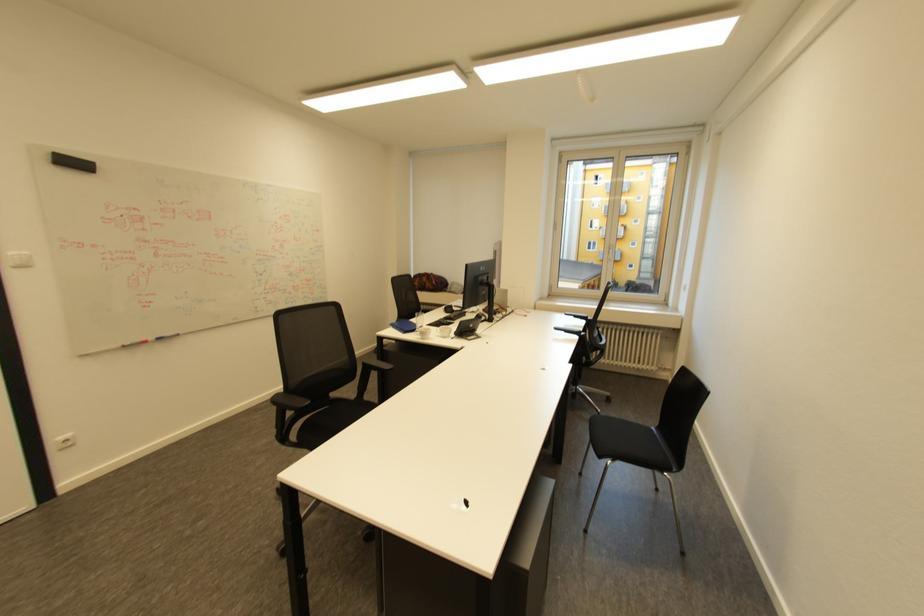
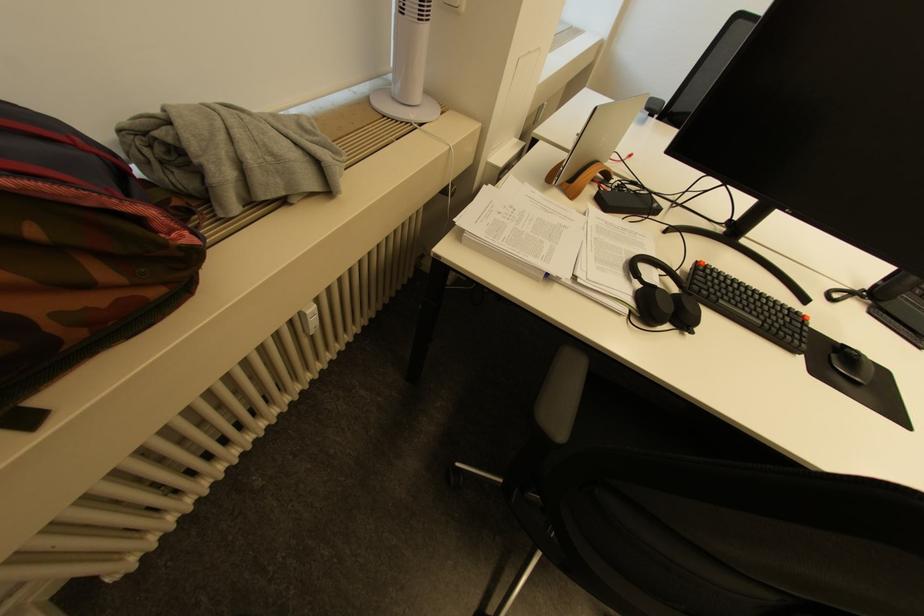
Question: I am providing you with two images of the same scene from different viewpoints. After the viewpoint changes to image2, which objects are now occluded?

Choices:
 (A) patterned trash bin
 (B) black keyboard
 (C) chair armrest
 (D) black chair armrest

Answer: (D)